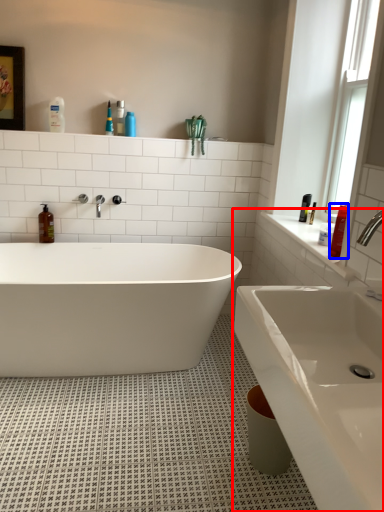
Question: Which point is further to the camera, sink (highlighted by a red box) or toiletry (highlighted by a blue box)?

Choices:
 (A) sink
 (B) toiletry

Answer: (B)